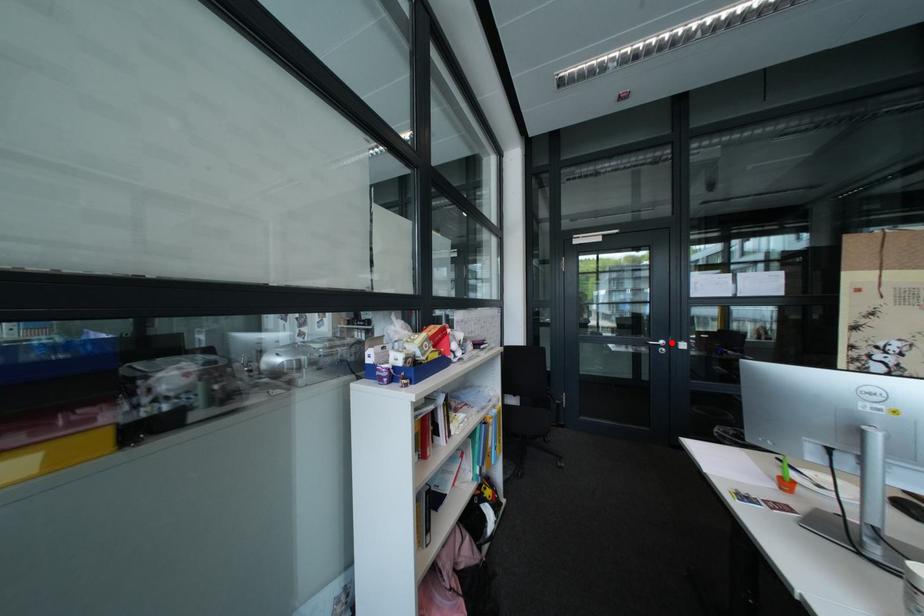
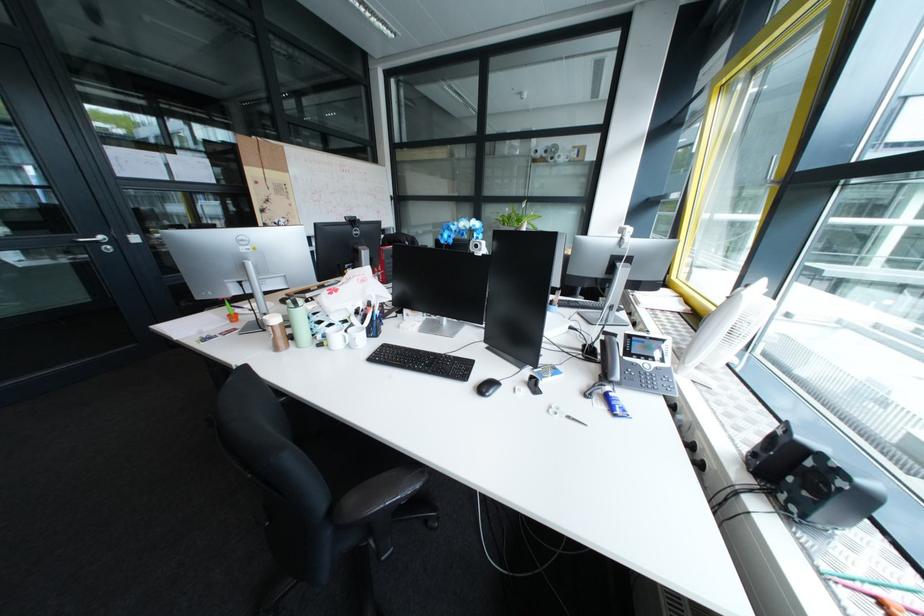
Question: I am providing you with two images of the same scene from different viewpoints. A red point is marked on the first image. At the location where the point appears in image 1, is it still visible in image 2?

Choices:
 (A) Yes
 (B) No

Answer: (A)